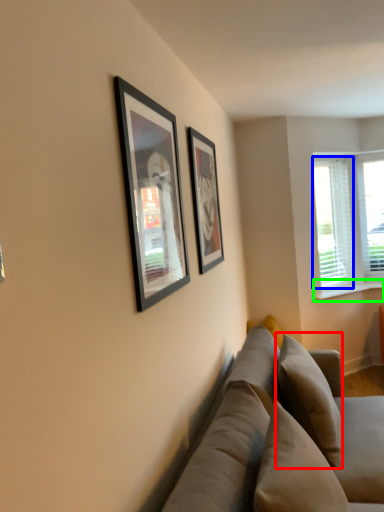
Question: Which object is positioned closest to pillow (highlighted by a red box)? Select from window screen (highlighted by a blue box) and window sill (highlighted by a green box).

Choices:
 (A) window screen
 (B) window sill

Answer: (B)